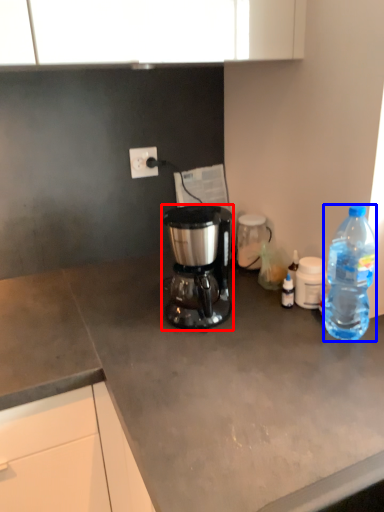
Question: Among these objects, which one is nearest to the camera, coffee maker (highlighted by a red box) or bottle (highlighted by a blue box)?

Choices:
 (A) coffee maker
 (B) bottle

Answer: (B)